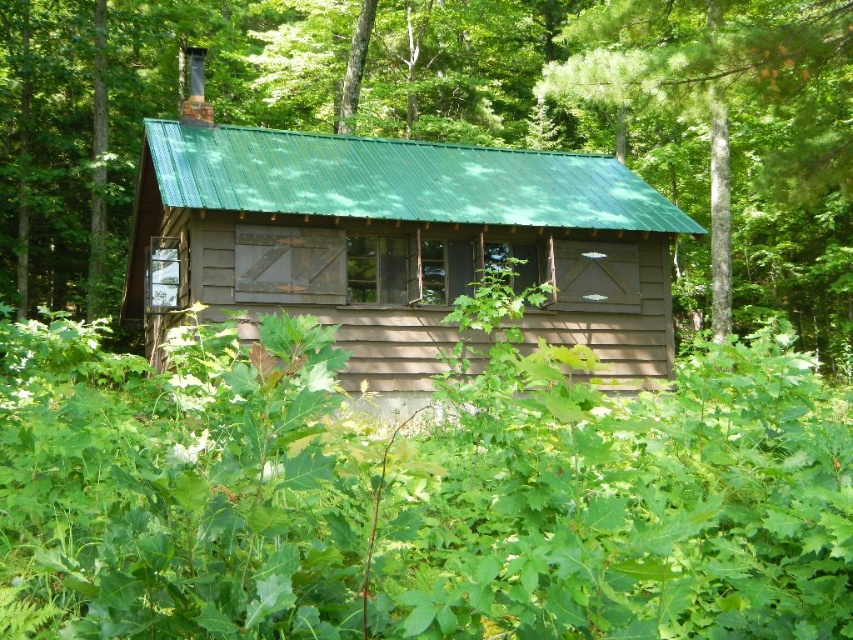
Question: Considering the real-world distances, which object is farthest from the green leafy tree at center?

Choices:
 (A) green leafy foliage at center
 (B) brown wooden cabin at center

Answer: (A)

Question: Is the position of green leafy foliage at center more distant than that of brown wooden cabin at center?

Choices:
 (A) yes
 (B) no

Answer: (B)

Question: Which object is the closest to the green leafy foliage at center?

Choices:
 (A) green leafy tree at center
 (B) brown wooden cabin at center

Answer: (B)

Question: Which object appears closest to the camera in this image?

Choices:
 (A) green leafy tree at center
 (B) green leafy foliage at center
 (C) brown wooden cabin at center

Answer: (B)

Question: Is green leafy foliage at center positioned at the back of green leafy tree at center?

Choices:
 (A) no
 (B) yes

Answer: (A)

Question: Can you confirm if green leafy tree at center is positioned to the right of brown wooden cabin at center?

Choices:
 (A) yes
 (B) no

Answer: (B)